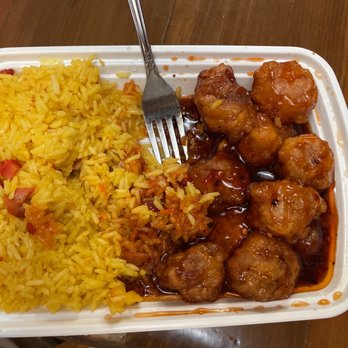
You are a GUI agent. You are given a task and a screenshot of the screen. Output one action in this format:
    pyautogui.click(x=<x>, y=<y>)
    Task: Click on the sauce in the crease of the serving tray
    This screenshot has height=348, width=348.
    Given the screenshot: What is the action you would take?
    pyautogui.click(x=202, y=311)